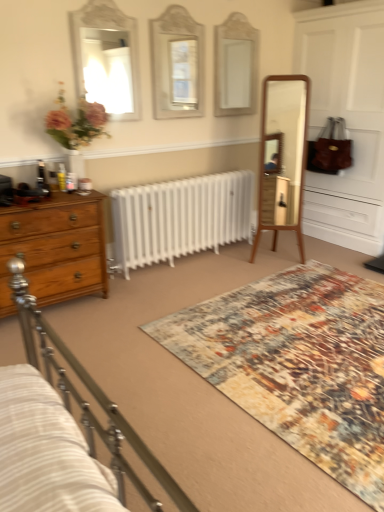
I want to click on free spot above matte white mirror at center, the second mirror in the left-to-right sequence (from a real-world perspective), so click(x=175, y=2).